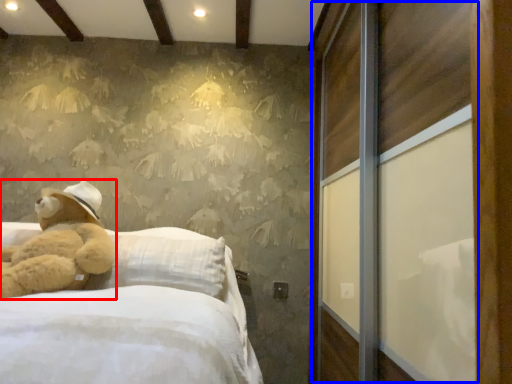
Question: Which point is closer to the camera, teddy bear (highlighted by a red box) or screen door (highlighted by a blue box)?

Choices:
 (A) teddy bear
 (B) screen door

Answer: (B)